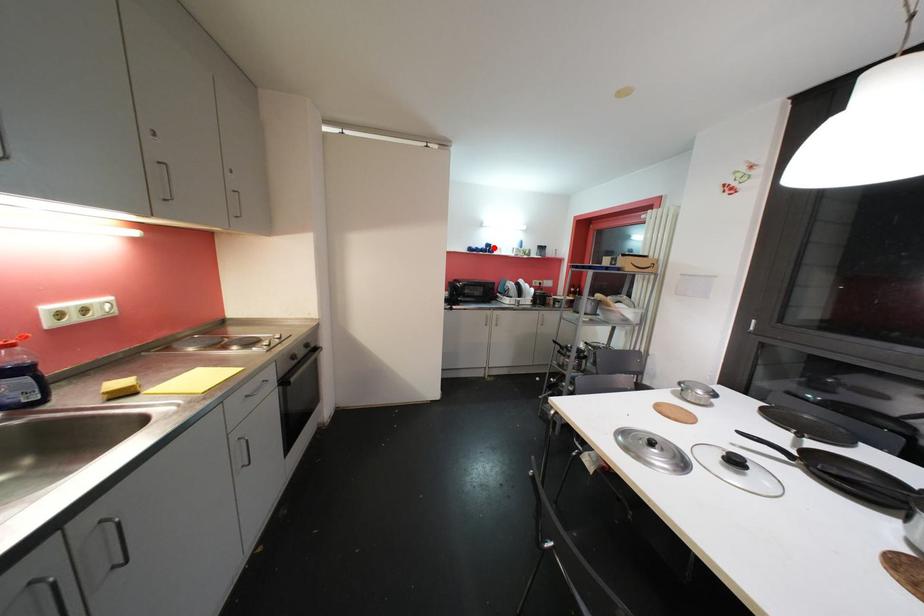
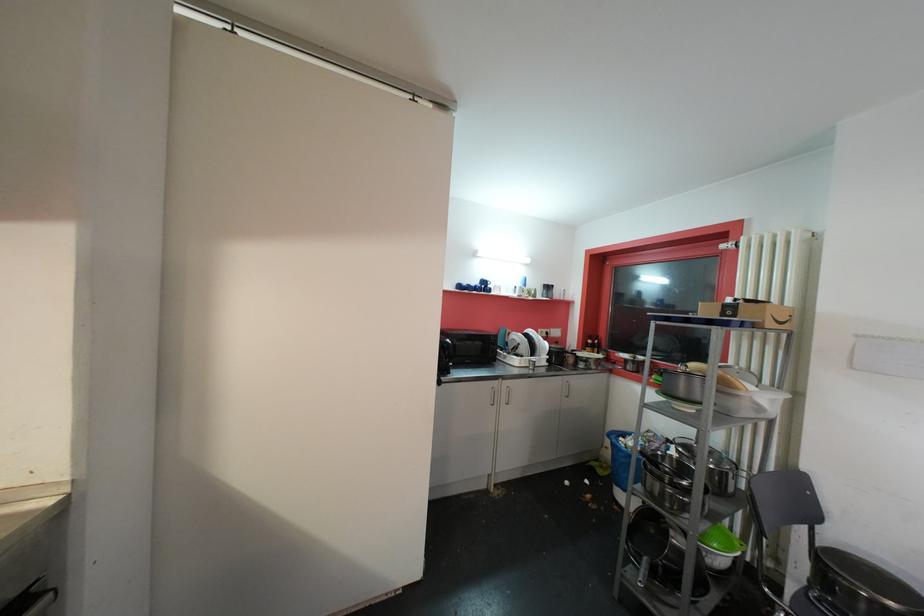
Locate, in the second image, the point that corresponds to the highlighted location in the first image.

(489, 285)